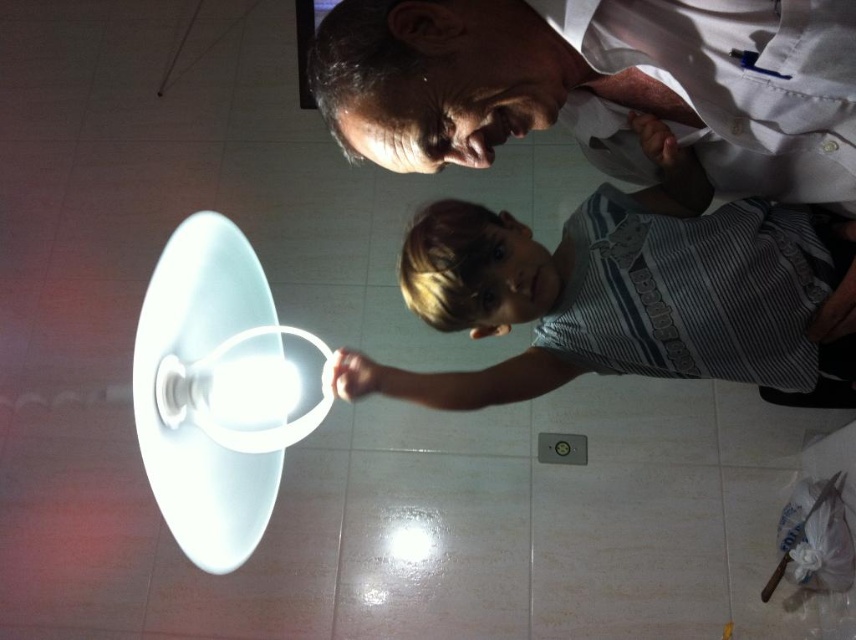
Can you confirm if white glossy lampshade at lower left is wider than striped cotton shirt at center?

No, white glossy lampshade at lower left is not wider than striped cotton shirt at center.

This screenshot has height=640, width=856. I want to click on white glossy lampshade at lower left, so click(215, 392).

Based on the photo, is white shirt at upper center below striped cotton shirt at center?

Incorrect, white shirt at upper center is not positioned below striped cotton shirt at center.

Between white shirt at upper center and striped cotton shirt at center, which one appears on the right side from the viewer's perspective?

striped cotton shirt at center

Is point (825, 20) behind point (485, 273)?

No, it is not.

Where is `white shirt at upper center`? white shirt at upper center is located at coordinates (597, 77).

Between white shirt at upper center and white glossy lampshade at lower left, which one is positioned lower?

Positioned lower is white glossy lampshade at lower left.

Which is more to the left, white shirt at upper center or white glossy lampshade at lower left?

From the viewer's perspective, white glossy lampshade at lower left appears more on the left side.

Describe the element at coordinates (597, 77) in the screenshot. I see `white shirt at upper center` at that location.

In order to click on white shirt at upper center in this screenshot , I will do `click(597, 77)`.